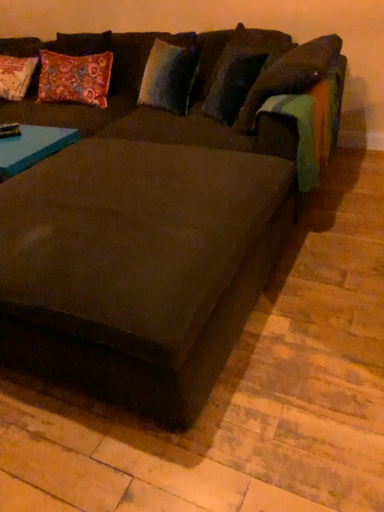
Question: Would you say suede-like dark brown couch at center is inside or outside velvety blue pillow at upper center, arranged as the second pillow when viewed from the right?

Choices:
 (A) inside
 (B) outside

Answer: (B)

Question: From the image's perspective, is suede-like dark brown couch at center above or below velvety blue pillow at upper center, arranged as the second pillow when viewed from the right?

Choices:
 (A) above
 (B) below

Answer: (B)

Question: Based on their relative distances, which object is nearer to the velvety blue pillow at upper center, positioned as the 1th pillow in left-to-right order?

Choices:
 (A) velvety brown pillow at upper right, which ranks as the second pillow in left-to-right order
 (B) suede-like dark brown couch at center

Answer: (A)

Question: Which is farther from the velvety blue pillow at upper center, arranged as the second pillow when viewed from the right?

Choices:
 (A) velvety brown pillow at upper right, which ranks as the second pillow in left-to-right order
 (B) suede-like dark brown couch at center

Answer: (B)